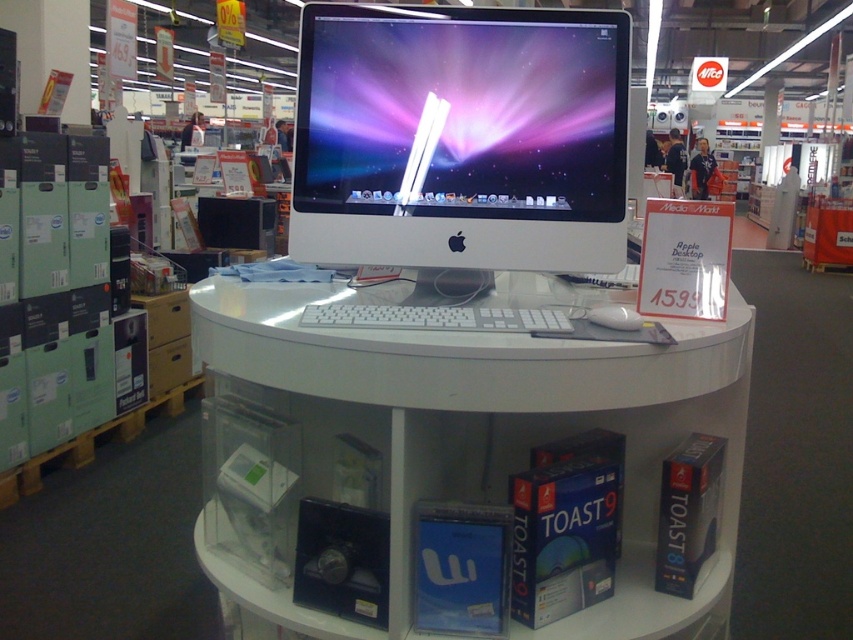
Question: Is white glossy computer monitor at center above white matte keyboard at center?

Choices:
 (A) yes
 (B) no

Answer: (A)

Question: Can you confirm if white glossy computer desk at center is bigger than white matte keyboard at center?

Choices:
 (A) no
 (B) yes

Answer: (B)

Question: Which object is the farthest from the white glossy computer desk at center?

Choices:
 (A) white matte keyboard at center
 (B) white plastic mouse at center
 (C) white glossy computer monitor at center

Answer: (B)

Question: Where is white glossy computer monitor at center located in relation to white plastic mouse at center in the image?

Choices:
 (A) right
 (B) left

Answer: (B)

Question: Which object is positioned closest to the white glossy computer monitor at center?

Choices:
 (A) white plastic mouse at center
 (B) white glossy computer desk at center
 (C) white matte keyboard at center

Answer: (C)

Question: Which of these objects is positioned farthest from the white glossy computer desk at center?

Choices:
 (A) white glossy computer monitor at center
 (B) white plastic mouse at center
 (C) white matte keyboard at center

Answer: (B)